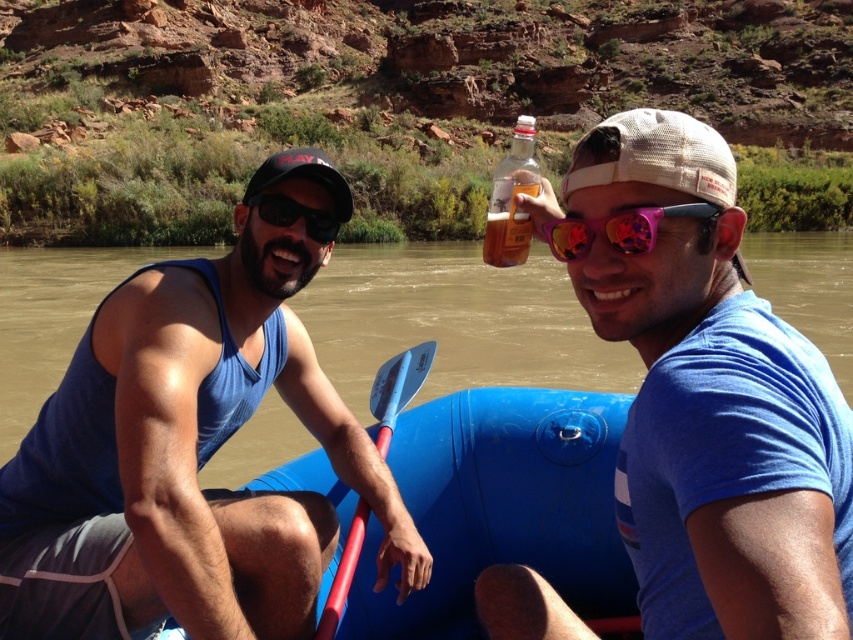
Question: Does blue fabric tank top at left appear on the right side of pink reflective sunglasses at center?

Choices:
 (A) no
 (B) yes

Answer: (A)

Question: Considering the real-world distances, which object is farthest from the blue plastic paddle at center?

Choices:
 (A) brown rubber raft at center
 (B) translucent glass bottle at upper center
 (C) pink reflective sunglasses at center
 (D) matte black sunglasses at left

Answer: (A)

Question: Can you confirm if blue plastic paddle at center is thinner than pink reflective sunglasses at center?

Choices:
 (A) yes
 (B) no

Answer: (A)

Question: Which point appears closest to the camera in this image?

Choices:
 (A) (355, 516)
 (B) (585, 385)
 (C) (575, 218)

Answer: (A)

Question: Does matte blue shirt at center appear over pink reflective sunglasses at center?

Choices:
 (A) no
 (B) yes

Answer: (A)

Question: Estimate the real-world distances between objects in this image. Which object is farther from the matte blue shirt at center?

Choices:
 (A) translucent glass bottle at upper center
 (B) blue fabric tank top at left
 (C) pink reflective sunglasses at center

Answer: (A)